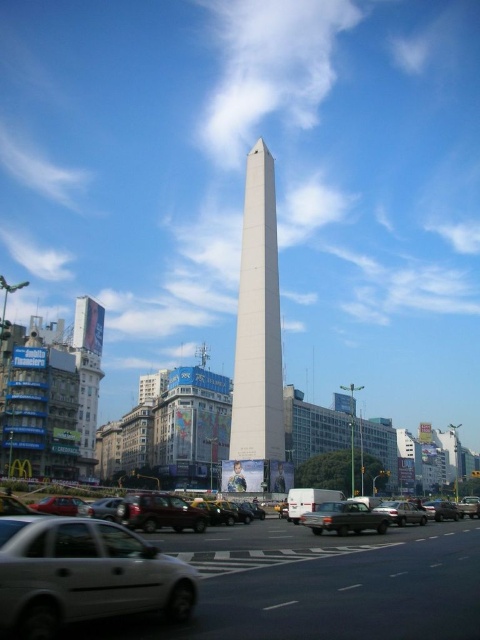
Question: Which object appears farthest from the camera in this image?

Choices:
 (A) metallic maroon sedan at center
 (B) metallic silver sedan at center
 (C) matte gray sedan at center

Answer: (B)

Question: Which of the following is the farthest from the observer?

Choices:
 (A) metallic maroon sedan at center
 (B) white smooth obelisk at center
 (C) metallic silver sedan at center
 (D) matte gray sedan at center

Answer: (B)

Question: Can you confirm if white smooth obelisk at center is bigger than metallic silver sedan at center?

Choices:
 (A) yes
 (B) no

Answer: (A)

Question: Which point is closer to the camera taking this photo?

Choices:
 (A) [x=127, y=502]
 (B) [x=403, y=520]

Answer: (A)

Question: Does white smooth obelisk at center lie in front of metallic silver sedan at center?

Choices:
 (A) yes
 (B) no

Answer: (B)

Question: Can you confirm if metallic maroon sedan at center is positioned to the left of metallic silver sedan at center?

Choices:
 (A) no
 (B) yes

Answer: (B)